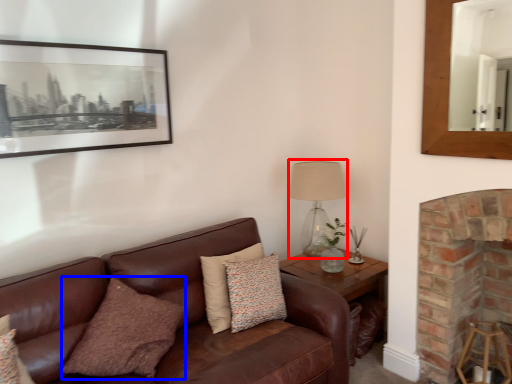
Question: Which object is further to the camera taking this photo, table lamp (highlighted by a red box) or pillow (highlighted by a blue box)?

Choices:
 (A) table lamp
 (B) pillow

Answer: (A)